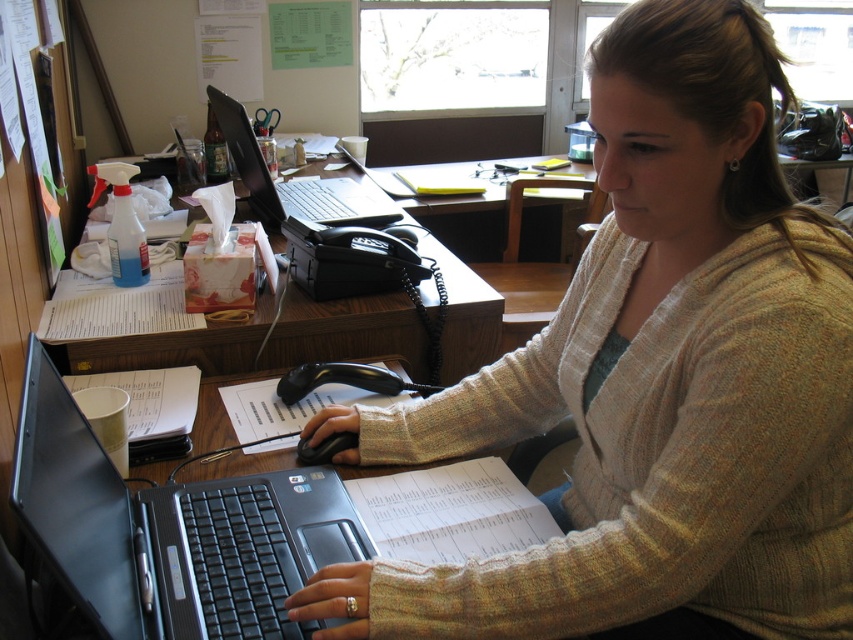
Question: Which point appears farthest from the camera in this image?

Choices:
 (A) (253, 180)
 (B) (33, 467)

Answer: (A)

Question: Does light beige sweater at center have a greater width compared to woodendesk at center?

Choices:
 (A) no
 (B) yes

Answer: (A)

Question: Considering the real-world distances, which object is closest to the matte black laptop at center?

Choices:
 (A) light beige sweater at center
 (B) black plastic laptop at center

Answer: (A)

Question: Which point appears farthest from the camera in this image?

Choices:
 (A) (595, 540)
 (B) (223, 515)
 (C) (339, 218)
 (D) (247, 369)

Answer: (C)

Question: From the image, what is the correct spatial relationship of black plastic laptop at center in relation to woodendesk at center?

Choices:
 (A) right
 (B) left

Answer: (A)

Question: Does woodendesk at center appear on the right side of matte black laptop at center?

Choices:
 (A) no
 (B) yes

Answer: (B)